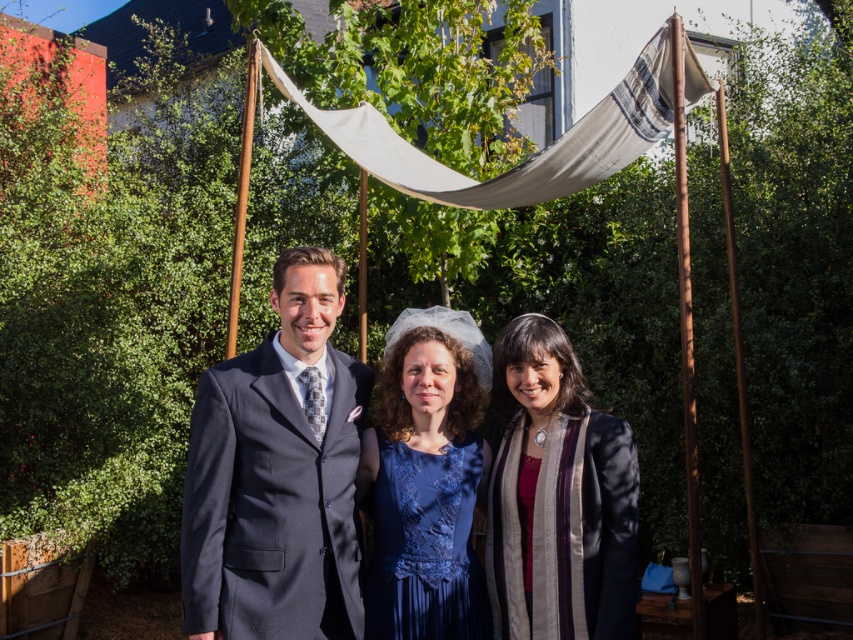
Question: Is navy blue suit at center smaller than silky beige scarf at center?

Choices:
 (A) yes
 (B) no

Answer: (B)

Question: Which point appears closest to the camera in this image?

Choices:
 (A) (450, 529)
 (B) (564, 621)
 (C) (635, 108)

Answer: (B)

Question: Is silky beige scarf at center further to camera compared to dark gray suit at center?

Choices:
 (A) no
 (B) yes

Answer: (A)

Question: Considering the relative positions of silky beige scarf at center and dark gray suit at center in the image provided, where is silky beige scarf at center located with respect to dark gray suit at center?

Choices:
 (A) left
 (B) right

Answer: (B)

Question: Based on their relative distances, which object is nearer to the dark gray suit at center?

Choices:
 (A) blue lace dress at center
 (B) navy blue suit at center
 (C) silky beige scarf at center
 (D) white canvas canopy at upper center

Answer: (C)

Question: Which object is closer to the camera taking this photo?

Choices:
 (A) white canvas canopy at upper center
 (B) blue lace dress at center
 (C) dark gray suit at center
 (D) silky beige scarf at center

Answer: (B)